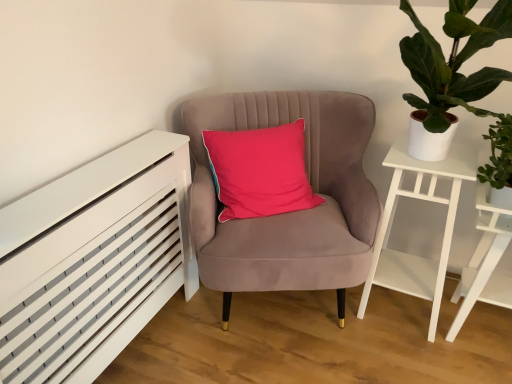
Question: Is white wooden side table at right thinner than white matte side table at right?

Choices:
 (A) yes
 (B) no

Answer: (B)

Question: Is white matte side table at right inside white wooden side table at right?

Choices:
 (A) yes
 (B) no

Answer: (B)

Question: Does white wooden side table at right lie behind white matte side table at right?

Choices:
 (A) yes
 (B) no

Answer: (B)

Question: From a real-world perspective, is white wooden side table at right physically below white matte side table at right?

Choices:
 (A) no
 (B) yes

Answer: (B)

Question: Is white wooden side table at right completely or partially outside of white matte side table at right?

Choices:
 (A) no
 (B) yes

Answer: (B)

Question: From the image's perspective, relative to white wooden side table at right, is velvet pink chair at center above or below?

Choices:
 (A) above
 (B) below

Answer: (A)

Question: Is velvet pink chair at center situated inside white wooden side table at right or outside?

Choices:
 (A) inside
 (B) outside

Answer: (B)

Question: Considering their positions, is velvet pink chair at center located in front of or behind white wooden side table at right?

Choices:
 (A) behind
 (B) front

Answer: (B)

Question: Looking at the image, does velvet pink chair at center seem bigger or smaller compared to white wooden side table at right?

Choices:
 (A) small
 (B) big

Answer: (B)

Question: From the image's perspective, is white matte side table at right located above or below green leafy plant at right?

Choices:
 (A) above
 (B) below

Answer: (B)

Question: Considering the positions of point (403, 145) and point (505, 69), is point (403, 145) closer or farther from the camera than point (505, 69)?

Choices:
 (A) farther
 (B) closer

Answer: (A)

Question: Is white matte side table at right bigger or smaller than green leafy plant at right?

Choices:
 (A) big
 (B) small

Answer: (B)

Question: Considering the positions of white matte side table at right and green leafy plant at right in the image, is white matte side table at right wider or thinner than green leafy plant at right?

Choices:
 (A) thin
 (B) wide

Answer: (A)

Question: Relative to white matte side table at right, is velvet pink chair at center in front or behind?

Choices:
 (A) behind
 (B) front

Answer: (B)

Question: From their relative heights in the image, would you say velvet pink chair at center is taller or shorter than white matte side table at right?

Choices:
 (A) tall
 (B) short

Answer: (A)